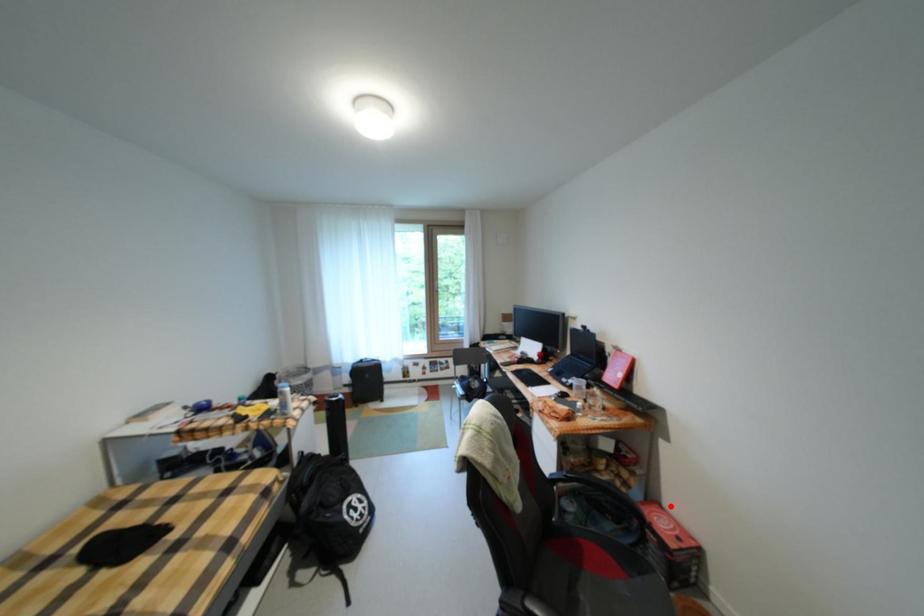
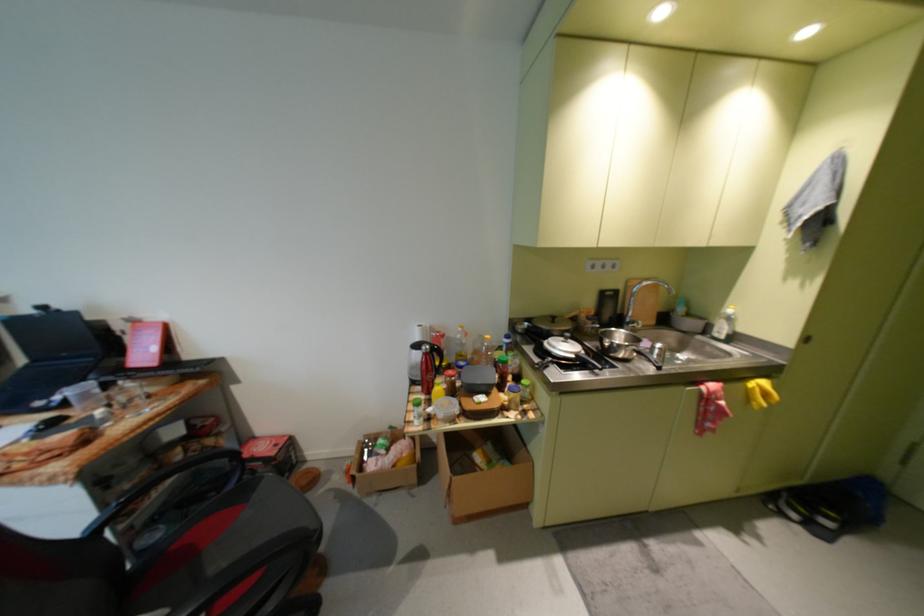
Find the pixel in the second image that matches the highlighted location in the first image.

(264, 439)